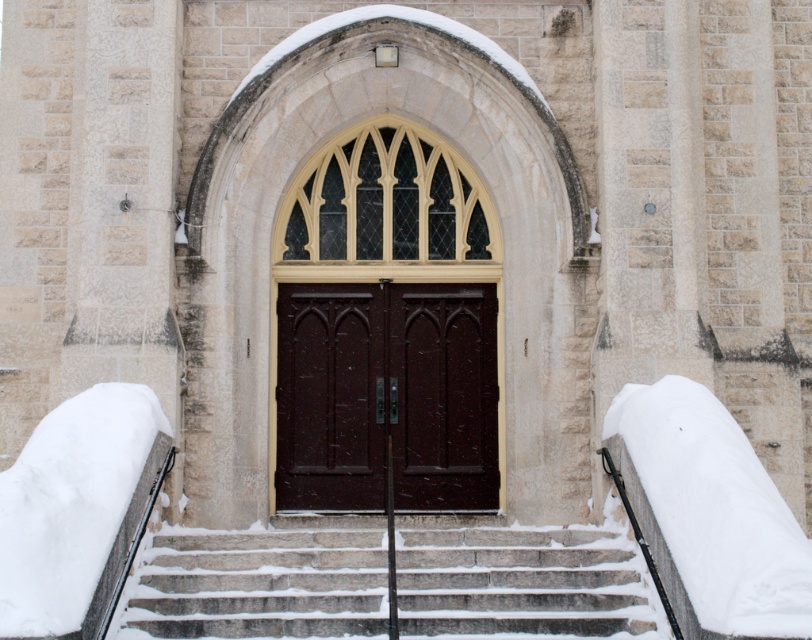
Question: Can you confirm if gray stone stairs at center is wider than dark wood doors at center?

Choices:
 (A) yes
 (B) no

Answer: (A)

Question: Is gray stone stairs at center bigger than dark wood doors at center?

Choices:
 (A) yes
 (B) no

Answer: (A)

Question: Is gray stone stairs at center wider than dark wood doors at center?

Choices:
 (A) no
 (B) yes

Answer: (B)

Question: Which object appears closest to the camera in this image?

Choices:
 (A) gray stone stairs at center
 (B) dark wood doors at center

Answer: (A)